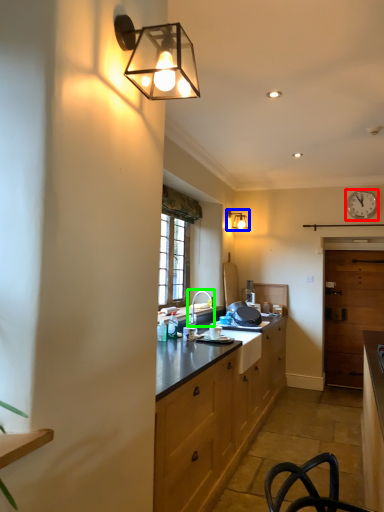
Question: Based on their relative distances, which object is farther from clock (highlighted by a red box)? Choose from lamp (highlighted by a blue box) and tap (highlighted by a green box).

Choices:
 (A) lamp
 (B) tap

Answer: (B)